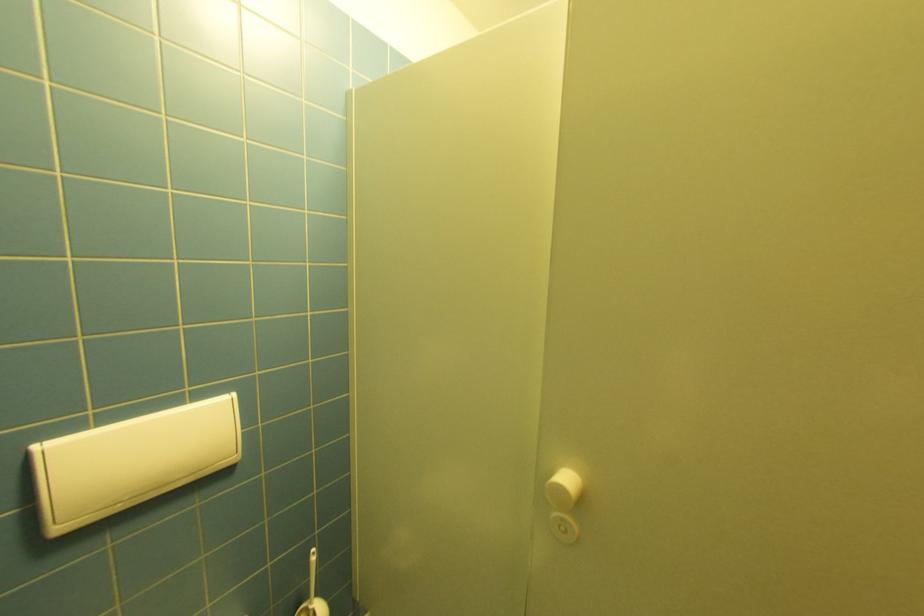
Where would you push the white flush plate? Please return your answer as a coordinate pair (x, y).

(130, 461)